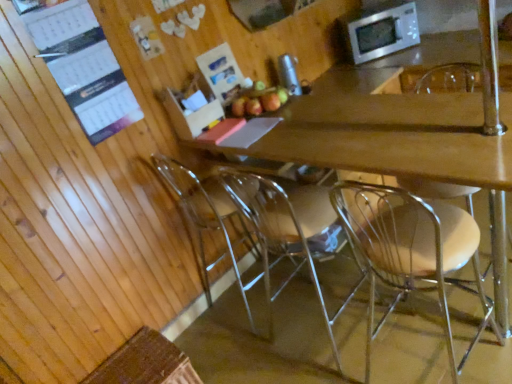
Where is `vacant region in front of clear plastic chair at lower center, the 4th chair when ordered from right to left`? This screenshot has width=512, height=384. vacant region in front of clear plastic chair at lower center, the 4th chair when ordered from right to left is located at coordinates pos(255,348).